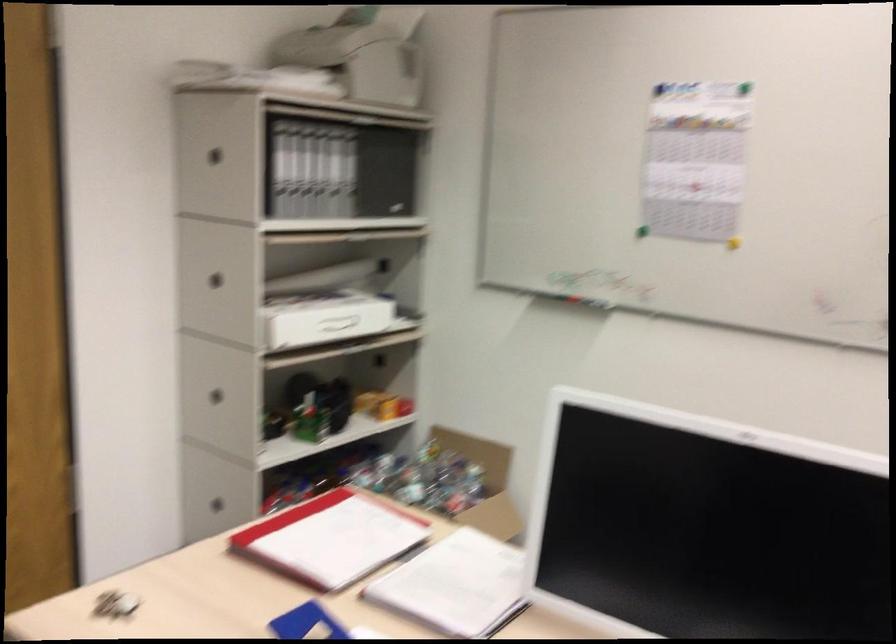
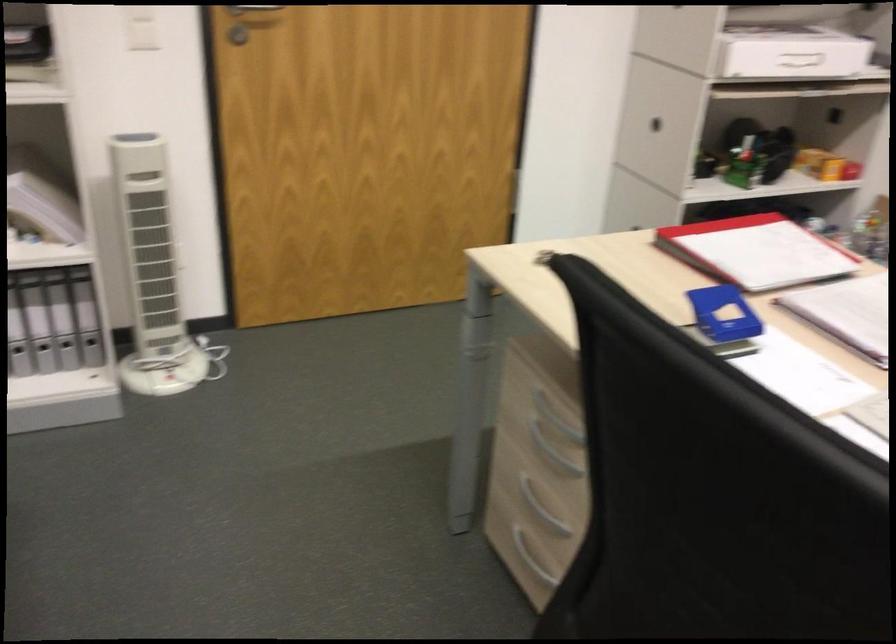
In the second image, find the point that corresponds to point (336, 536) in the first image.

(756, 251)